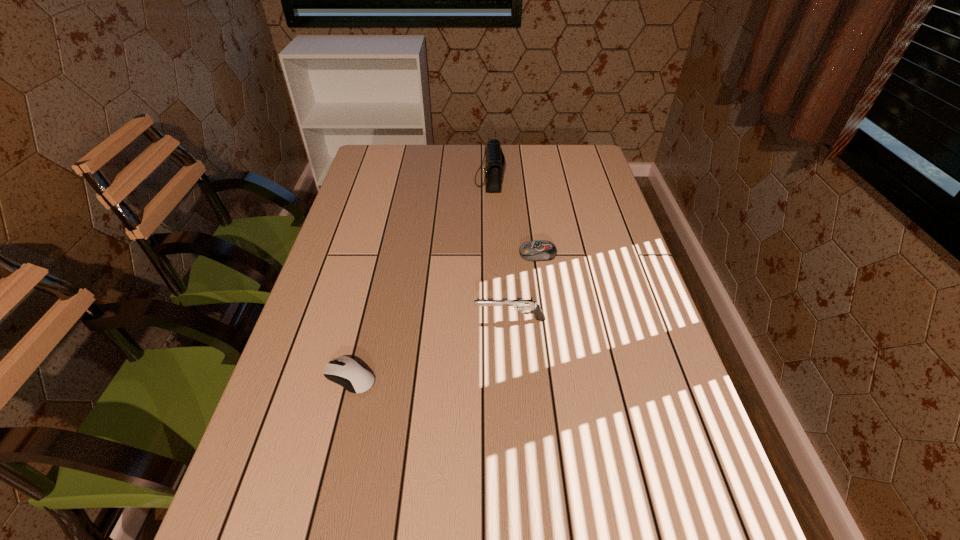
Find the location of `the tallest object`. the tallest object is located at coordinates (495, 161).

Image resolution: width=960 pixels, height=540 pixels. Find the location of `the farthest object`. the farthest object is located at coordinates (495, 161).

Where is `the third farthest object`? the third farthest object is located at coordinates (520, 305).

Where is `the second tallest object`? This screenshot has width=960, height=540. the second tallest object is located at coordinates (520, 305).

Image resolution: width=960 pixels, height=540 pixels. What are the coordinates of `the nearer computer mouse` in the screenshot? It's located at (345, 371).

Locate an element on the screen. The height and width of the screenshot is (540, 960). the left computer mouse is located at coordinates (345, 371).

Identify the location of the farther computer mouse. (540, 250).

Where is `the right computer mouse`? The width and height of the screenshot is (960, 540). the right computer mouse is located at coordinates (540, 250).

Where is `free space located 0.090m on the front flap of the tallest object`? This screenshot has height=540, width=960. free space located 0.090m on the front flap of the tallest object is located at coordinates (447, 180).

This screenshot has width=960, height=540. Identify the location of free region located on the front flap of the tallest object. (382, 180).